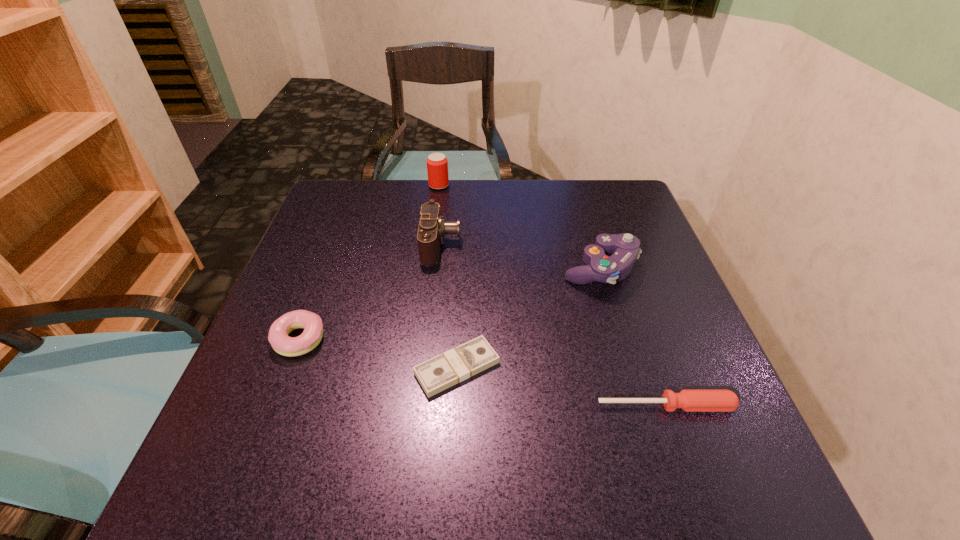
You are a GUI agent. You are given a task and a screenshot of the screen. Output one action in this format:
    pyautogui.click(x=<x>, y=<y>)
    Task: Click on the vacant area at the left edge of the desktop
    
    Given the screenshot: What is the action you would take?
    pyautogui.click(x=264, y=411)

At what (x,y) coordinates should I click in order to perform the action: click on free space at the right edge of the desktop. Please return your answer as a coordinate pair (x, y). Looking at the image, I should click on (654, 283).

At what (x,y) coordinates should I click in order to perform the action: click on vacant region at the far left corner. Please return your answer as a coordinate pair (x, y). Looking at the image, I should click on (369, 181).

Find the location of a particular element. The width and height of the screenshot is (960, 540). vacant region at the far right corner of the desktop is located at coordinates (604, 189).

You are a GUI agent. You are given a task and a screenshot of the screen. Output one action in this format:
    pyautogui.click(x=<x>, y=<y>)
    Task: Click on the vacant space that's between the camera and the leftmost object
    
    Given the screenshot: What is the action you would take?
    pyautogui.click(x=371, y=292)

Find the location of a particular element. vacant region between the control and the farthest object is located at coordinates (519, 227).

Where is `free spot between the control and the fifth tallest object`? free spot between the control and the fifth tallest object is located at coordinates (633, 337).

The height and width of the screenshot is (540, 960). Identify the location of vacant point located between the screwdriver and the doughnut. (483, 373).

Where is `free point between the screwdriver and the control`? The image size is (960, 540). free point between the screwdriver and the control is located at coordinates (633, 337).

This screenshot has height=540, width=960. Identify the location of free spot between the dollar and the doughnut. (378, 353).